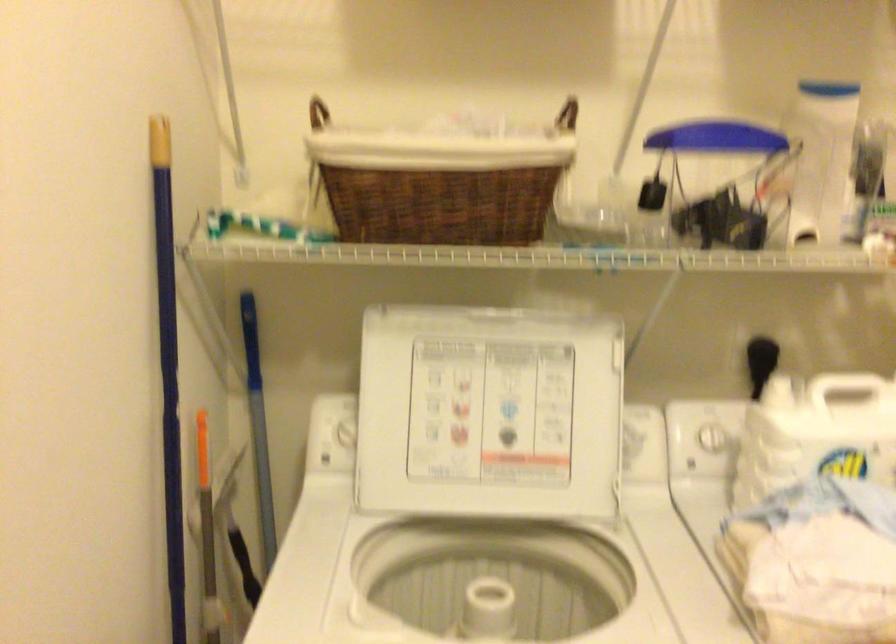
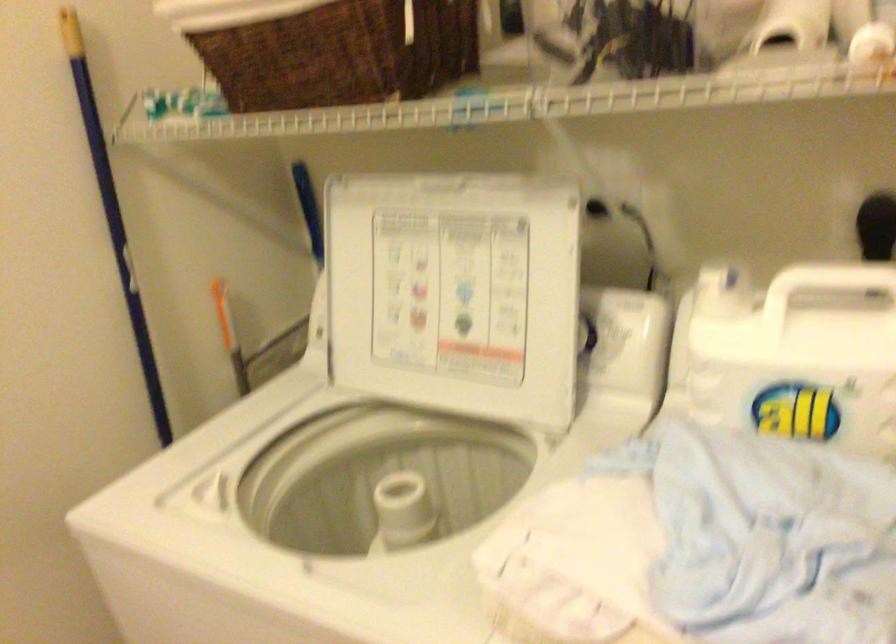
Find the pixel in the second image that matches (709,402) in the first image.

(804, 288)